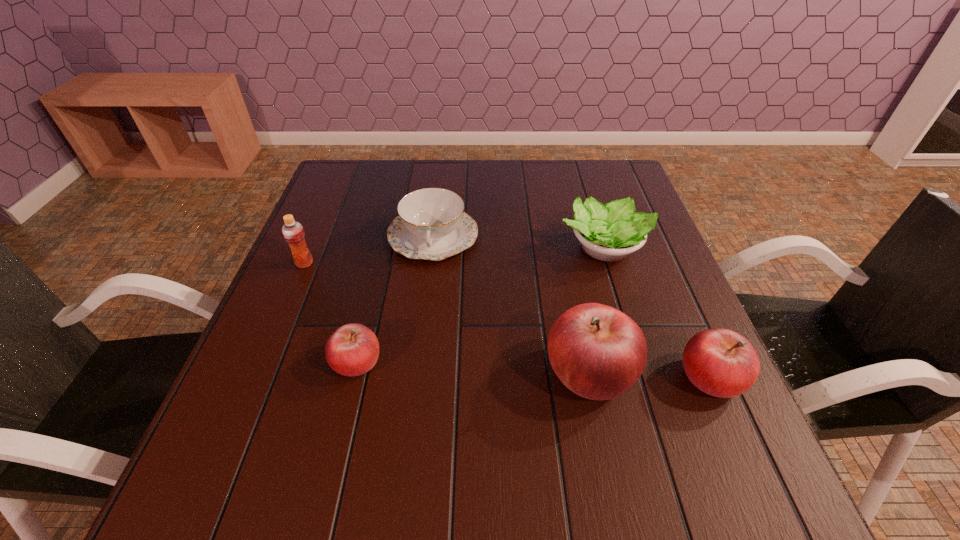
Locate which object ranks fourth in proximity to the second apple from left to right. Please provide its 2D coordinates. Your answer should be formatted as a tuple, i.e. [(x, y)], where the tuple contains the x and y coordinates of a point satisfying the conditions above.

[(353, 349)]

Select which object appears as the third closest to the chinaware. Please provide its 2D coordinates. Your answer should be formatted as a tuple, i.e. [(x, y)], where the tuple contains the x and y coordinates of a point satisfying the conditions above.

[(353, 349)]

Image resolution: width=960 pixels, height=540 pixels. I want to click on apple that is the second closest to the lettuce, so click(x=720, y=362).

What are the coordinates of `apple that stands as the third closest to the orange juice` in the screenshot? It's located at (x=720, y=362).

Image resolution: width=960 pixels, height=540 pixels. What are the coordinates of `free region that satisfies the following two spatial constraints: 1. on the handle side of the lettuce; 2. on the right side of the chinaware` in the screenshot? It's located at [432, 248].

I want to click on vacant position in the image that satisfies the following two spatial constraints: 1. on the handle side of the chinaware; 2. on the right side of the lettuce, so click(x=432, y=248).

The image size is (960, 540). In order to click on free space in the image that satisfies the following two spatial constraints: 1. on the handle side of the chinaware; 2. on the right side of the second apple from left to right in this screenshot , I will do `click(417, 372)`.

This screenshot has width=960, height=540. What are the coordinates of `vacant space that satisfies the following two spatial constraints: 1. on the back side of the lettuce; 2. on the right side of the shortest apple` in the screenshot? It's located at (384, 248).

Identify the location of free space that satisfies the following two spatial constraints: 1. on the front side of the tallest apple; 2. on the right side of the second shortest apple. The height and width of the screenshot is (540, 960). pos(591,377).